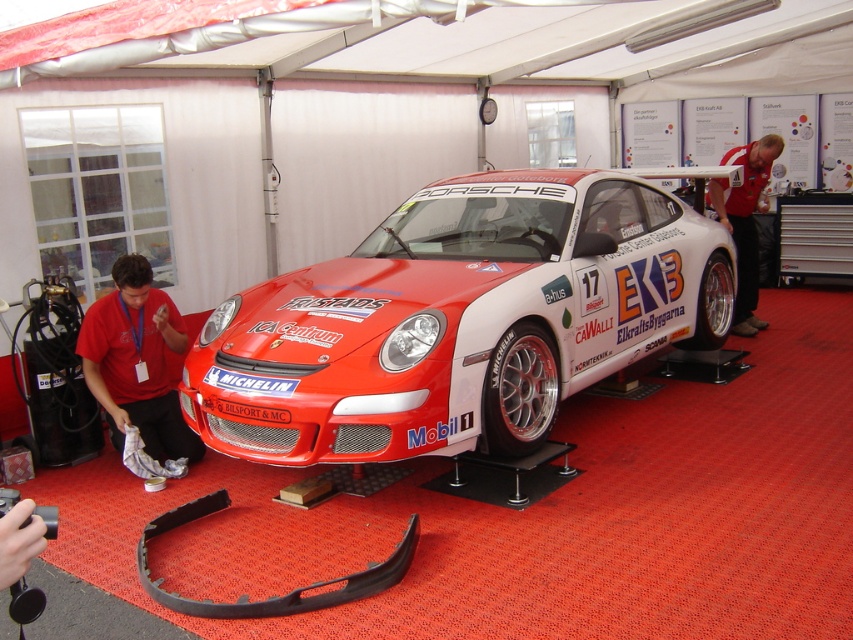
You are a photographer standing at the base of the tent where the Porsche race car is displayed. You want to capture a photo that includes both the matte red shirt at lower left and the red fabric shirt at upper right. Given that your camera has a maximum focal length that allows capturing objects within a 16 feet range, will you be able to include both shirts in the same frame?

The distance between the matte red shirt at lower left and the red fabric shirt at upper right is 15.51 feet, which is within the camera maximum focal length of 16 feet. Therefore, you can include both shirts in the same frame.

You are standing at the front of the red and white Porsche race car under the tent. There are two points marked on the car, one at coordinates point (519, 234) and another at point (756, 160). Which point is closer to you?

Point (519, 234) is in front of point (756, 160), so it is closer to you.

You are a photographer at the Porsche race car display. You want to take a photo that includes both the matte red shirt at lower left and the red fabric shirt at upper right. Which shirt will appear narrower in the photo?

The matte red shirt at lower left will appear narrower in the photo because it is thinner than the red fabric shirt at upper right.